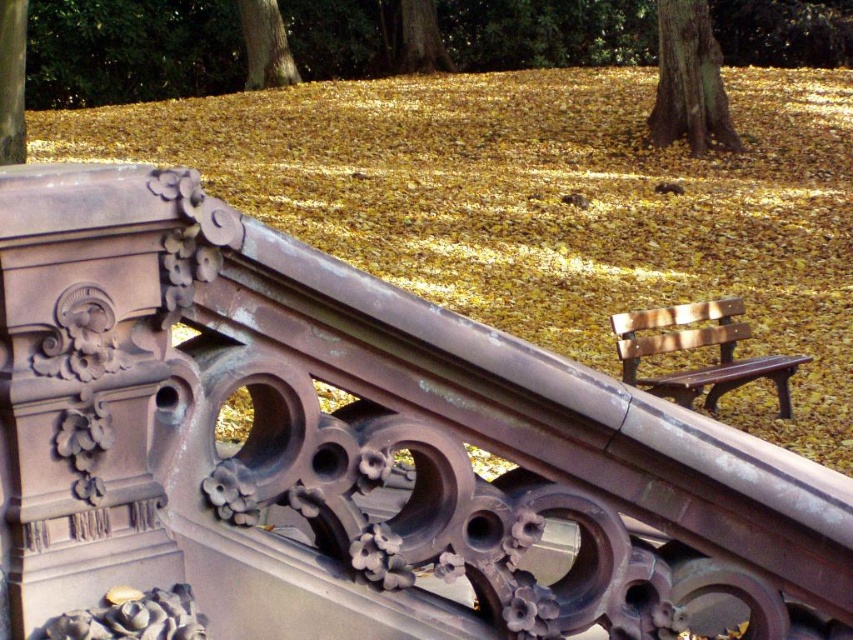
Which of these two, wooden bench at center or smooth brown bark at upper center, stands taller?

smooth brown bark at upper center is taller.

Identify the location of wooden bench at center. (697, 348).

Measure the distance between wooden bench at center and camera.

The distance of wooden bench at center from camera is 28.63 feet.

Locate an element on the screen. This screenshot has width=853, height=640. wooden bench at center is located at coordinates [x=697, y=348].

Is smooth brown tree trunk at upper left bigger than smooth brown bark at upper center?

Incorrect, smooth brown tree trunk at upper left is not larger than smooth brown bark at upper center.

What do you see at coordinates (12, 81) in the screenshot?
I see `smooth brown tree trunk at upper left` at bounding box center [12, 81].

Which is in front, point (7, 154) or point (287, 67)?

Point (7, 154)

You are a GUI agent. You are given a task and a screenshot of the screen. Output one action in this format:
    pyautogui.click(x=<x>, y=<y>)
    Task: Click on the smooth brown tree trunk at upper left
    The width and height of the screenshot is (853, 640).
    Given the screenshot: What is the action you would take?
    pyautogui.click(x=12, y=81)

Between smooth brown bark at upper right and smooth brown tree trunk at upper left, which one has less height?

Standing shorter between the two is smooth brown tree trunk at upper left.

Identify the location of smooth brown bark at upper right. This screenshot has height=640, width=853. (689, 81).

This screenshot has height=640, width=853. I want to click on smooth brown bark at upper right, so click(689, 81).